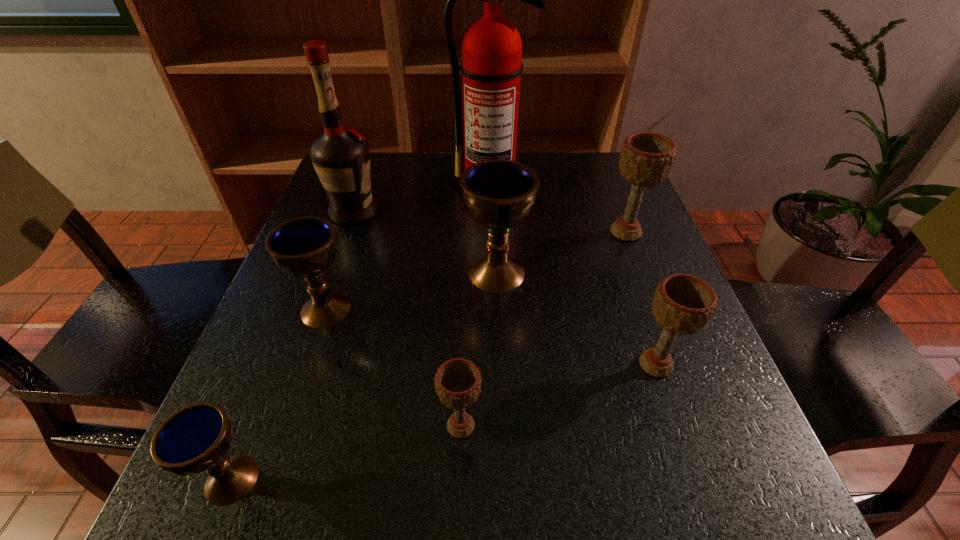
Identify the location of vacant area at the near right corner of the desktop. (663, 472).

You are a GUI agent. You are given a task and a screenshot of the screen. Output one action in this format:
    pyautogui.click(x=<x>, y=<y>)
    Task: Click on the empty location between the liquor and the smallest beige chalice
    
    Given the screenshot: What is the action you would take?
    pyautogui.click(x=407, y=319)

Locate an element on the screen. This screenshot has width=960, height=540. empty location between the second farthest beige chalice and the fire extinguisher is located at coordinates (573, 274).

The height and width of the screenshot is (540, 960). In order to click on vacant space in between the second nearest beige chalice and the rightmost blue chalice in this screenshot , I will do `click(576, 319)`.

Find the location of a particular element. Image resolution: width=960 pixels, height=540 pixels. vacant region between the nearest beige chalice and the biggest blue chalice is located at coordinates (479, 349).

Where is `free area in between the second nearest beige chalice and the farthest beige chalice`? free area in between the second nearest beige chalice and the farthest beige chalice is located at coordinates (640, 299).

Where is `unoccupied area between the rightmost blue chalice and the liquor`? The width and height of the screenshot is (960, 540). unoccupied area between the rightmost blue chalice and the liquor is located at coordinates (425, 242).

The height and width of the screenshot is (540, 960). Find the location of `empty space between the biggest beige chalice and the seventh farthest object`. empty space between the biggest beige chalice and the seventh farthest object is located at coordinates (543, 329).

The width and height of the screenshot is (960, 540). Identify the location of vacant area between the second tallest object and the fire extinguisher. (422, 198).

The image size is (960, 540). Identify the location of object that is the sixth closest one to the sixth farthest object. (196, 438).